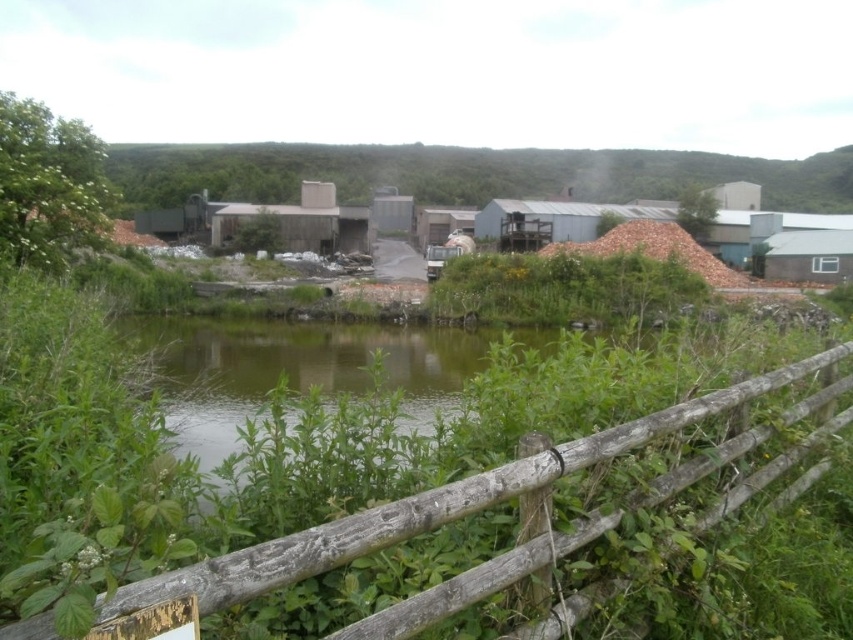
Question: Estimate the real-world distances between objects in this image. Which object is closer to the green leafy vegetation at center?

Choices:
 (A) weathered wood fence at lower center
 (B) green leafy bush at upper left

Answer: (B)

Question: Can you confirm if green grassy river at center is wider than green leafy vegetation at center?

Choices:
 (A) no
 (B) yes

Answer: (B)

Question: Among these objects, which one is nearest to the camera?

Choices:
 (A) green grassy river at center
 (B) weathered wood fence at lower center
 (C) green leafy bush at upper left
 (D) green leafy vegetation at center

Answer: (B)

Question: Which point is farther to the camera?

Choices:
 (A) pyautogui.click(x=36, y=627)
 (B) pyautogui.click(x=495, y=278)

Answer: (B)

Question: Where is green grassy river at center located in relation to weathered wood fence at lower center in the image?

Choices:
 (A) above
 (B) below

Answer: (B)

Question: Is green grassy river at center thinner than green leafy bush at upper left?

Choices:
 (A) yes
 (B) no

Answer: (B)